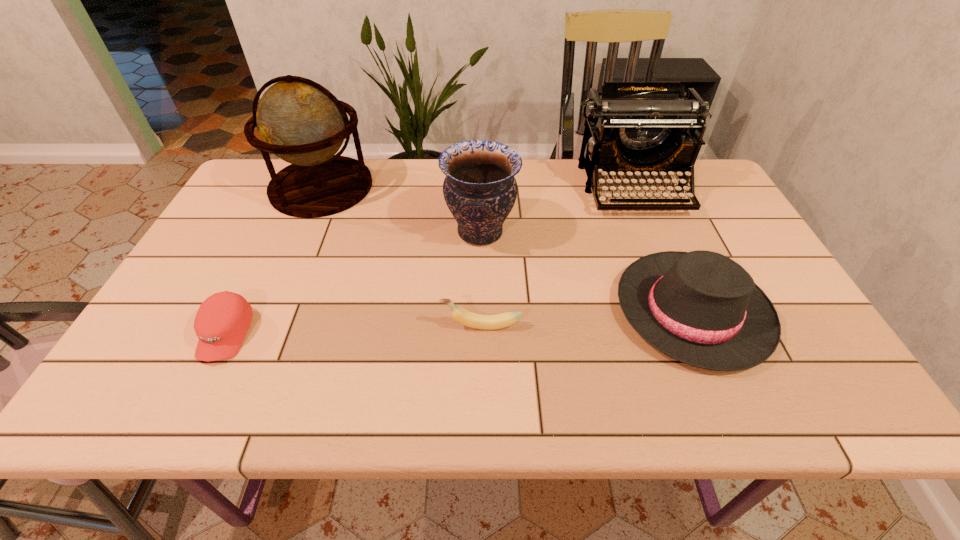
Where is `object that stands as the third closest to the third shortest object`? This screenshot has height=540, width=960. object that stands as the third closest to the third shortest object is located at coordinates pos(487,322).

Identify the location of the fourth closest object to the fourth tallest object. Image resolution: width=960 pixels, height=540 pixels. (300, 121).

The height and width of the screenshot is (540, 960). Identify the location of vacant space that satisfies the following two spatial constraints: 1. on the front-facing side of the globe; 2. on the front-facing side of the shortest object. (258, 334).

In order to click on blank space that satisfies the following two spatial constraints: 1. on the typing side of the typewriter; 2. on the front handle of the pottery in this screenshot , I will do `click(652, 232)`.

Identify the location of blank area in the image that satisfies the following two spatial constraints: 1. on the front handle of the dress hat; 2. on the left side of the fourth shortest object. (480, 311).

The height and width of the screenshot is (540, 960). Identify the location of vacant space that satisfies the following two spatial constraints: 1. on the typing side of the typewriter; 2. on the right side of the dress hat. (684, 311).

You are a GUI agent. You are given a task and a screenshot of the screen. Output one action in this format:
    pyautogui.click(x=<x>, y=<y>)
    Task: Click on the free space that satisfies the following two spatial constraints: 1. on the front handle of the fourth shortest object; 2. on the right side of the fourth tallest object
    This screenshot has height=540, width=960.
    Given the screenshot: What is the action you would take?
    pyautogui.click(x=480, y=311)

Find the location of a particular element. Image resolution: width=960 pixels, height=540 pixels. blank space that satisfies the following two spatial constraints: 1. at the stem of the second shortest object; 2. on the front-facing side of the shortest object is located at coordinates (482, 334).